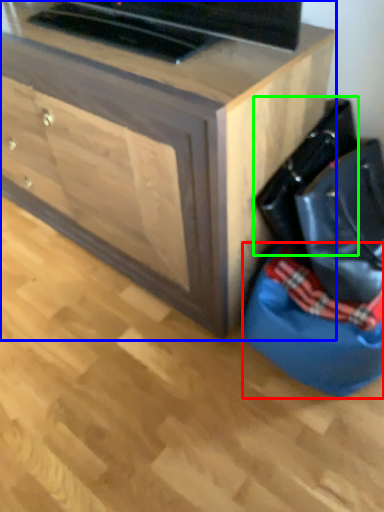
Question: Considering the real-world distances, which object is farthest from bean bag chair (highlighted by a red box)? chest of drawers (highlighted by a blue box) or messenger bag (highlighted by a green box)?

Choices:
 (A) chest of drawers
 (B) messenger bag

Answer: (A)